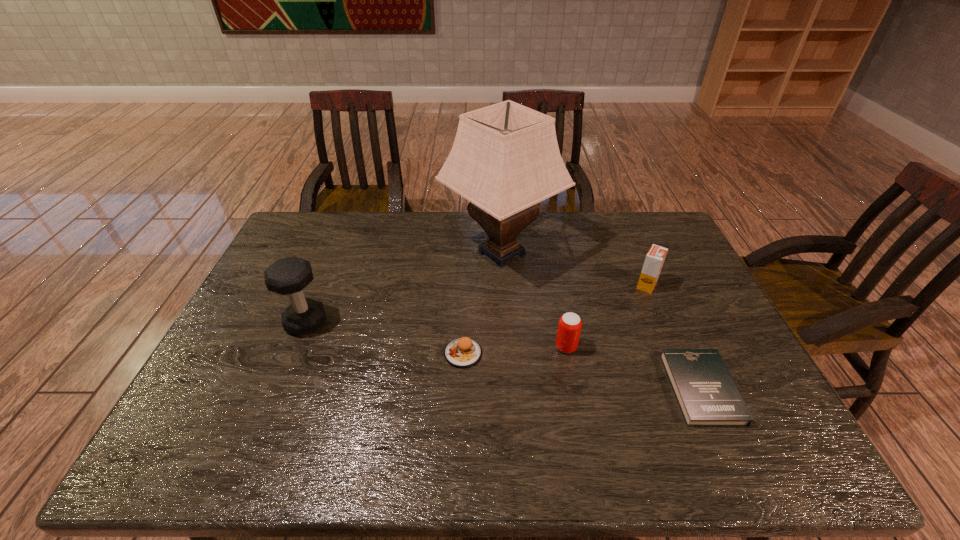
Image resolution: width=960 pixels, height=540 pixels. Identify the location of free space between the orange juice and the leftmost object. (476, 304).

Locate an element on the screen. vacant point located between the dumbbell and the third shortest object is located at coordinates (436, 335).

Select which object appears as the fourth closest to the fifth tallest object. Please provide its 2D coordinates. Your answer should be formatted as a tuple, i.e. [(x, y)], where the tuple contains the x and y coordinates of a point satisfying the conditions above.

[(707, 395)]

Find the location of a particular element. The width and height of the screenshot is (960, 540). object that is the third closest one to the shortest object is located at coordinates (505, 159).